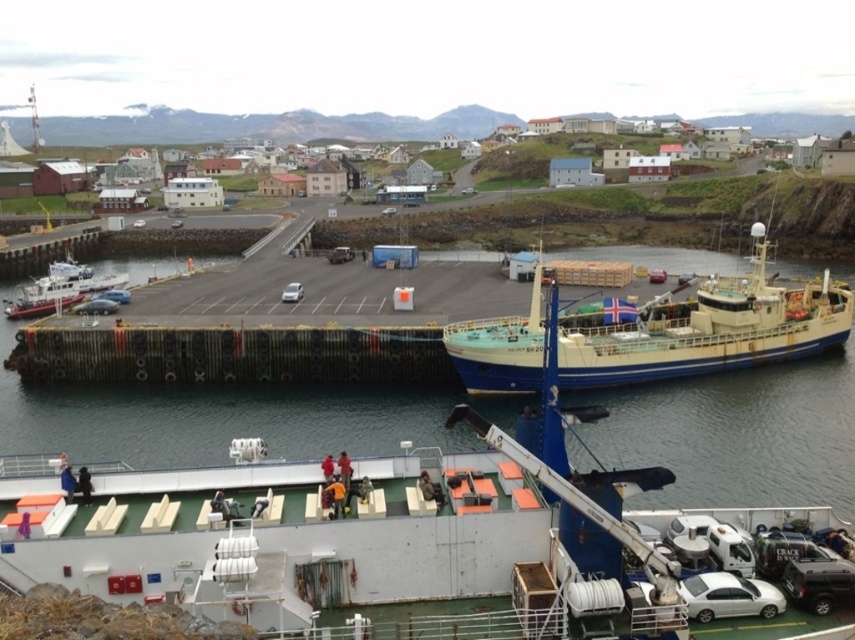
Question: Which of the following is the farthest from the observer?

Choices:
 (A) (98, 305)
 (B) (634, 616)

Answer: (A)

Question: Is white matte boat at center below white plastic boat at left?

Choices:
 (A) no
 (B) yes

Answer: (B)

Question: Can you confirm if white matte boat at center is thinner than white plastic boat at left?

Choices:
 (A) no
 (B) yes

Answer: (A)

Question: Does white matte boat at center have a smaller size compared to white matte car at center?

Choices:
 (A) yes
 (B) no

Answer: (B)

Question: Estimate the real-world distances between objects in this image. Which object is closer to the white matte boat at center?

Choices:
 (A) white matte sedan at lower right
 (B) blue painted steel boat at center
 (C) white matte car at center

Answer: (A)

Question: Which of the following is the farthest from the observer?

Choices:
 (A) (298, 300)
 (B) (563, 381)
 (C) (99, 300)

Answer: (A)